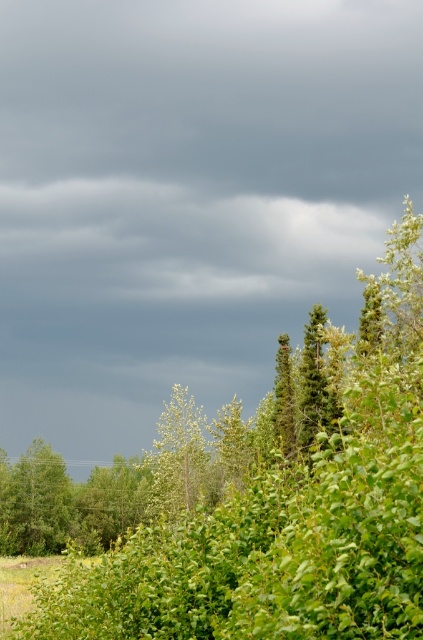
Question: Which point is closer to the camera?

Choices:
 (A) pyautogui.click(x=184, y=451)
 (B) pyautogui.click(x=16, y=472)
 (C) pyautogui.click(x=420, y=506)

Answer: (C)

Question: Is green leafy tree at upper center wider than green leafy tree at lower left?

Choices:
 (A) yes
 (B) no

Answer: (A)

Question: Does green leafy tree at upper center appear on the right side of green leafy tree at center?

Choices:
 (A) yes
 (B) no

Answer: (A)

Question: Among these points, which one is nearest to the camera?

Choices:
 (A) (202, 448)
 (B) (57, 500)
 (C) (99, 572)

Answer: (C)

Question: Based on their relative distances, which object is farther from the green leafy tree at upper center?

Choices:
 (A) green leafy tree at center
 (B) green leafy tree at lower left

Answer: (B)

Question: Can you confirm if green leafy tree at lower left is positioned to the left of green leafy tree at center?

Choices:
 (A) yes
 (B) no

Answer: (A)